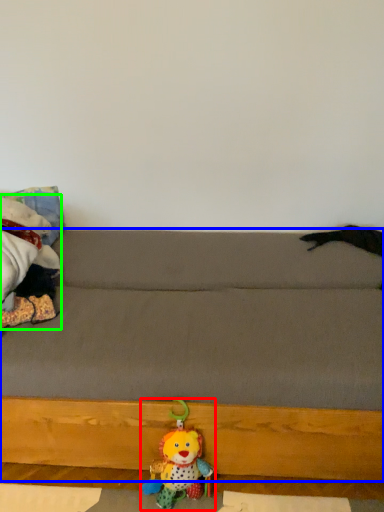
Question: Which object is the closest to the toy (highlighted by a red box)? Choose among these: studio couch (highlighted by a blue box) or toy (highlighted by a green box).

Choices:
 (A) studio couch
 (B) toy

Answer: (A)